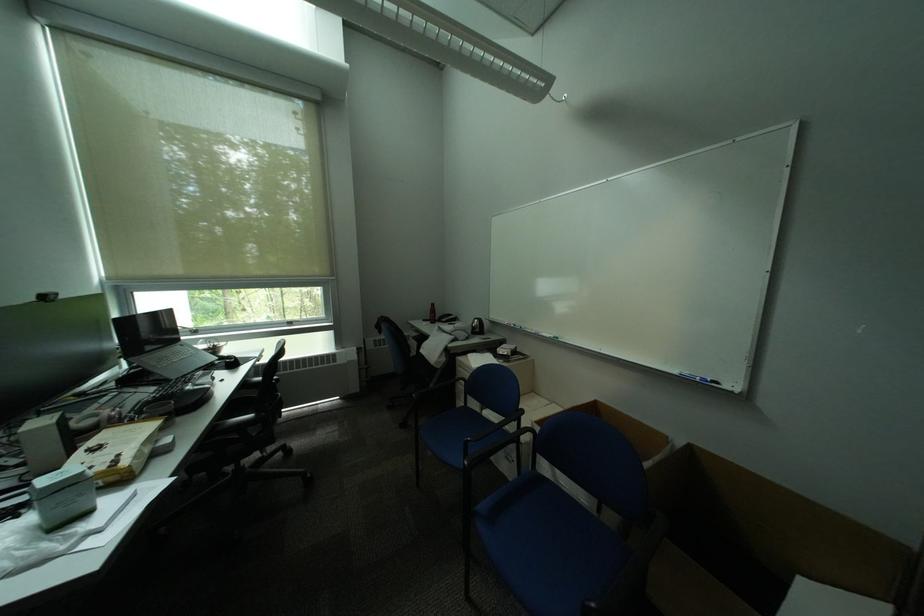
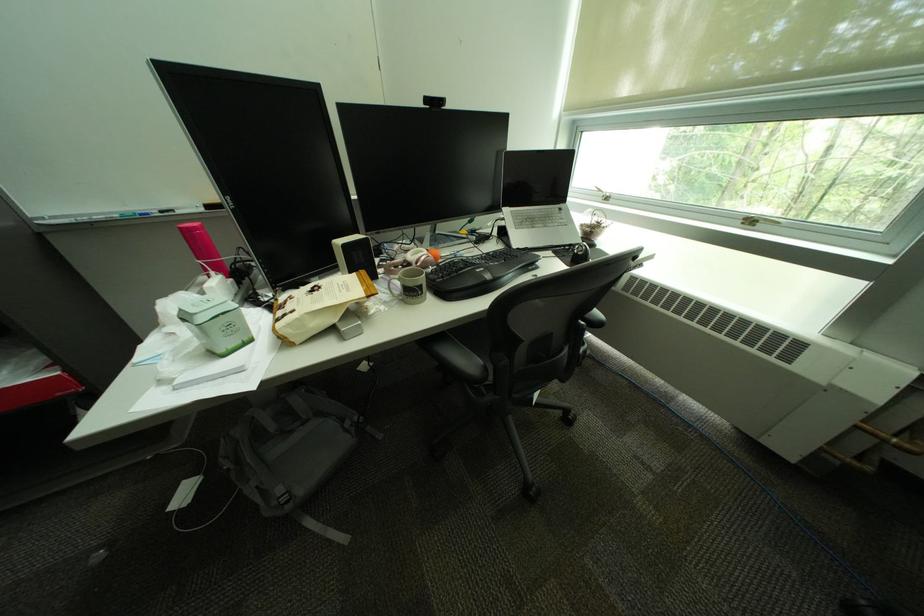
In the second image, find the point that corresponds to [150,451] in the first image.

(309, 321)